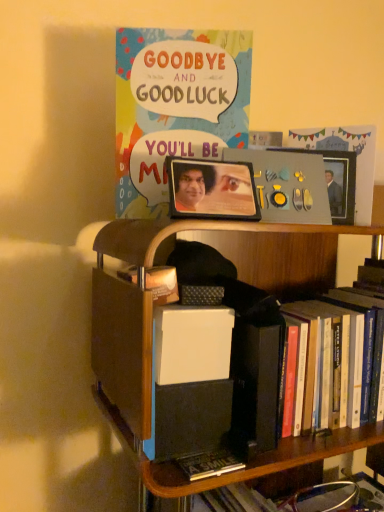
The height and width of the screenshot is (512, 384). Identify the location of metallic photo frame at center, the 2th picture frame in the back-to-front sequence. (212, 190).

I want to click on wooden bookcase at center, so click(x=231, y=246).

At what (x,y) coordinates should I click in order to perform the action: click on matte paper comic book at upper center. Please return your answer as a coordinate pair (x, y). Looking at the image, I should click on (175, 106).

Is matte paper comic book at upper center positioned with its back to wooden bookcase at center?

No.

What's the angular difference between matte paper comic book at upper center and wooden bookcase at center's facing directions?

23.5 degrees.

Who is bigger, matte paper comic book at upper center or wooden bookcase at center?

wooden bookcase at center.

Is matte paper comic book at upper center touching wooden bookcase at center?

No, matte paper comic book at upper center is not beside wooden bookcase at center.

Is metallic silver picture frame at upper right, the 2th picture frame positioned from the left, to the right of wooden bookcase at center from the viewer's perspective?

Indeed, metallic silver picture frame at upper right, the 2th picture frame positioned from the left, is positioned on the right side of wooden bookcase at center.

Can you confirm if metallic silver picture frame at upper right, the second picture frame when ordered from front to back, is wider than wooden bookcase at center?

Incorrect, the width of metallic silver picture frame at upper right, the second picture frame when ordered from front to back, does not surpass that of wooden bookcase at center.

Would you say wooden bookcase at center is part of metallic silver picture frame at upper right, the second picture frame when ordered from front to back,'s contents?

Actually, wooden bookcase at center is outside metallic silver picture frame at upper right, the second picture frame when ordered from front to back.

Is there a large distance between metallic silver picture frame at upper right, the 2th picture frame positioned from the left, and wooden bookcase at center?

They are positioned close to each other.

Considering the relative positions of metallic silver picture frame at upper right, the first picture frame in the right-to-left sequence, and matte paper comic book at upper center in the image provided, is metallic silver picture frame at upper right, the first picture frame in the right-to-left sequence, to the left of matte paper comic book at upper center from the viewer's perspective?

In fact, metallic silver picture frame at upper right, the first picture frame in the right-to-left sequence, is to the right of matte paper comic book at upper center.

Which is farther from the camera, [345,183] or [137,42]?

The point [345,183] is behind.

From the image's perspective, is metallic silver picture frame at upper right, the second picture frame when ordered from front to back, positioned above or below matte paper comic book at upper center?

From the image's perspective, metallic silver picture frame at upper right, the second picture frame when ordered from front to back, appears below matte paper comic book at upper center.

From a real-world perspective, which object rests below the other?

wooden bookcase at center is physically lower.

Can you tell me how much wooden bookcase at center and metallic photo frame at center, the 2th picture frame in the back-to-front sequence, differ in facing direction?

9.46 degrees.

From the picture: Is wooden bookcase at center next to metallic photo frame at center, the 2th picture frame in the back-to-front sequence, and touching it?

wooden bookcase at center and metallic photo frame at center, the 2th picture frame in the back-to-front sequence, are not in contact.

Can you confirm if matte paper comic book at upper center is wider than metallic silver picture frame at upper right, the second picture frame when ordered from front to back?

Yes, matte paper comic book at upper center is wider than metallic silver picture frame at upper right, the second picture frame when ordered from front to back.

Does matte paper comic book at upper center turn towards metallic silver picture frame at upper right, the first picture frame in the right-to-left sequence?

No.

Which is more to the right, matte paper comic book at upper center or metallic silver picture frame at upper right, acting as the 1th picture frame starting from the back?

metallic silver picture frame at upper right, acting as the 1th picture frame starting from the back, is more to the right.

Which of these two, matte paper comic book at upper center or metallic silver picture frame at upper right, acting as the 1th picture frame starting from the back, stands shorter?

Standing shorter between the two is metallic silver picture frame at upper right, acting as the 1th picture frame starting from the back.

Can you confirm if metallic silver picture frame at upper right, the first picture frame in the right-to-left sequence, is bigger than metallic photo frame at center, the 2th picture frame in the back-to-front sequence?

Incorrect, metallic silver picture frame at upper right, the first picture frame in the right-to-left sequence, is not larger than metallic photo frame at center, the 2th picture frame in the back-to-front sequence.

Is metallic silver picture frame at upper right, the first picture frame in the right-to-left sequence, positioned beyond the bounds of metallic photo frame at center, the 2th picture frame when ordered from right to left?

Yes, metallic silver picture frame at upper right, the first picture frame in the right-to-left sequence, is outside of metallic photo frame at center, the 2th picture frame when ordered from right to left.

From a real-world perspective, is metallic silver picture frame at upper right, the first picture frame in the right-to-left sequence, above or below metallic photo frame at center, acting as the 1th picture frame starting from the left?

metallic silver picture frame at upper right, the first picture frame in the right-to-left sequence, is situated higher than metallic photo frame at center, acting as the 1th picture frame starting from the left, in the real world.

Does point (334, 212) come behind point (225, 194)?

Yes, it is behind point (225, 194).

Is wooden bookcase at center not inside matte paper comic book at upper center?

Yes, wooden bookcase at center is not within matte paper comic book at upper center.

Can you confirm if wooden bookcase at center is taller than matte paper comic book at upper center?

Correct, wooden bookcase at center is much taller as matte paper comic book at upper center.

How much distance is there between wooden bookcase at center and matte paper comic book at upper center?

wooden bookcase at center is 9.07 inches from matte paper comic book at upper center.

Is wooden bookcase at center closer to the viewer compared to matte paper comic book at upper center?

Yes, it is.

The height and width of the screenshot is (512, 384). Find the location of `bookcase in front of the matte paper comic book at upper center`. bookcase in front of the matte paper comic book at upper center is located at coordinates (231, 246).

Where is `bookcase located underneath the metallic silver picture frame at upper right, the first picture frame in the right-to-left sequence (from a real-world perspective)`? Image resolution: width=384 pixels, height=512 pixels. bookcase located underneath the metallic silver picture frame at upper right, the first picture frame in the right-to-left sequence (from a real-world perspective) is located at coordinates (231, 246).

Looking at the image, which one is located closer to wooden bookcase at center, matte paper comic book at upper center or metallic silver picture frame at upper right, the first picture frame in the right-to-left sequence?

matte paper comic book at upper center.

Based on their spatial positions, is matte paper comic book at upper center or wooden bookcase at center closer to metallic photo frame at center, the 2th picture frame when ordered from right to left?

matte paper comic book at upper center.

Considering their positions, is metallic silver picture frame at upper right, the 2th picture frame positioned from the left, positioned further to matte paper comic book at upper center than metallic photo frame at center, placed as the first picture frame when sorted from front to back?

Based on the image, metallic silver picture frame at upper right, the 2th picture frame positioned from the left, appears to be further to matte paper comic book at upper center.

When comparing their distances from metallic photo frame at center, placed as the first picture frame when sorted from front to back, does wooden bookcase at center or matte paper comic book at upper center seem closer?

The object closer to metallic photo frame at center, placed as the first picture frame when sorted from front to back, is matte paper comic book at upper center.

Looking at the image, which one is located further to wooden bookcase at center, matte paper comic book at upper center or metallic photo frame at center, acting as the 1th picture frame starting from the left?

matte paper comic book at upper center.

Estimate the real-world distances between objects in this image. Which object is closer to metallic photo frame at center, placed as the first picture frame when sorted from front to back, matte paper comic book at upper center or metallic silver picture frame at upper right, the second picture frame when ordered from front to back?

matte paper comic book at upper center lies closer to metallic photo frame at center, placed as the first picture frame when sorted from front to back, than the other object.

Looking at the image, which one is located closer to wooden bookcase at center, metallic silver picture frame at upper right, the 2th picture frame positioned from the left, or metallic photo frame at center, the 2th picture frame in the back-to-front sequence?

metallic photo frame at center, the 2th picture frame in the back-to-front sequence, is closer to wooden bookcase at center.

When comparing their distances from metallic photo frame at center, the 2th picture frame in the back-to-front sequence, does metallic silver picture frame at upper right, the 2th picture frame positioned from the left, or matte paper comic book at upper center seem closer?

matte paper comic book at upper center is closer to metallic photo frame at center, the 2th picture frame in the back-to-front sequence.

The width and height of the screenshot is (384, 512). I want to click on picture frame situated between matte paper comic book at upper center and metallic silver picture frame at upper right, the second picture frame when ordered from front to back, from left to right, so click(x=212, y=190).

This screenshot has height=512, width=384. Find the location of `picture frame between metallic silver picture frame at upper right, the first picture frame in the right-to-left sequence, and wooden bookcase at center in the up-down direction`. picture frame between metallic silver picture frame at upper right, the first picture frame in the right-to-left sequence, and wooden bookcase at center in the up-down direction is located at coordinates (212, 190).